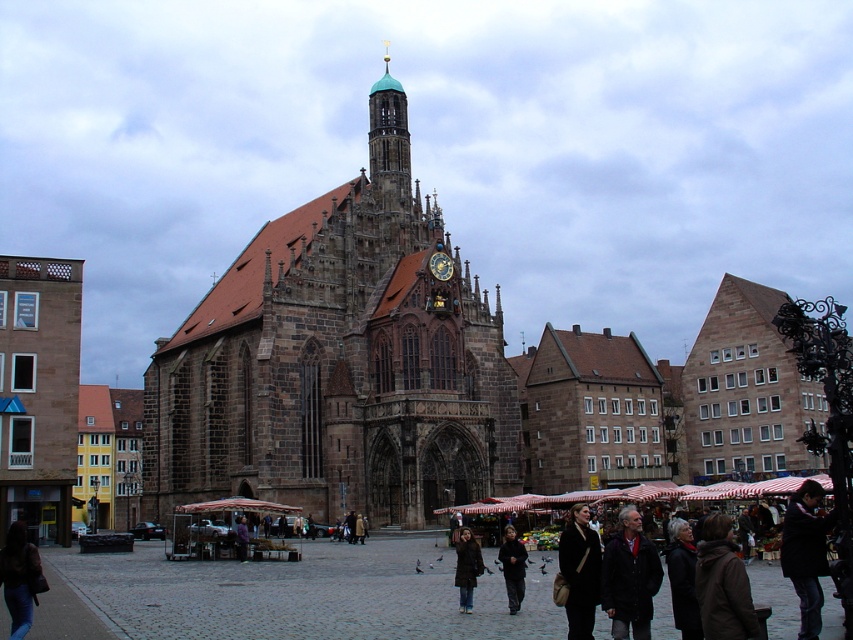
Question: Which object is the farthest from the dark brown leather jacket at center?

Choices:
 (A) brown leather jacket at lower right
 (B) denim jacket at lower left

Answer: (B)

Question: Does dark brown leather jacket at lower right lie behind dark brown leather jacket at center?

Choices:
 (A) yes
 (B) no

Answer: (B)

Question: Is brown stone church at center positioned at the back of brown leather jacket at lower right?

Choices:
 (A) yes
 (B) no

Answer: (A)

Question: Is denim jacket at lower left to the left of dark brown leather coat at center from the viewer's perspective?

Choices:
 (A) no
 (B) yes

Answer: (B)

Question: Which of the following is the farthest from the observer?

Choices:
 (A) dark gray fabric jacket at lower right
 (B) dark brown leather jacket at lower right

Answer: (A)

Question: Which of the following is the farthest from the observer?

Choices:
 (A) dark brown leather jacket at lower right
 (B) denim jacket at lower left
 (C) dark gray jacket at lower right
 (D) brown leather jacket at lower right

Answer: (B)